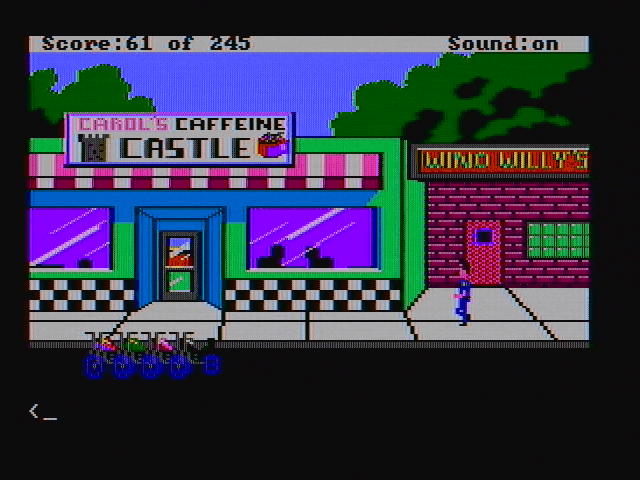
Locate an element on the screen. dark blue and purple glass windows is located at coordinates (297, 220), (49, 221).